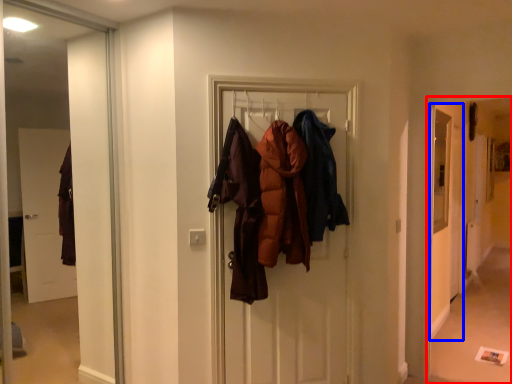
Question: Which object is closer to the camera taking this photo, corridor (highlighted by a red box) or screen door (highlighted by a blue box)?

Choices:
 (A) corridor
 (B) screen door

Answer: (A)